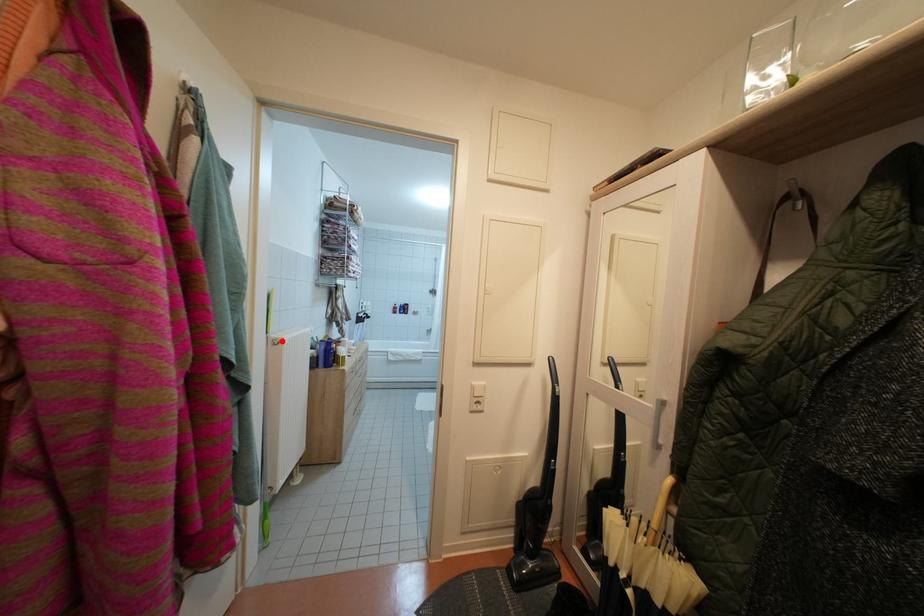
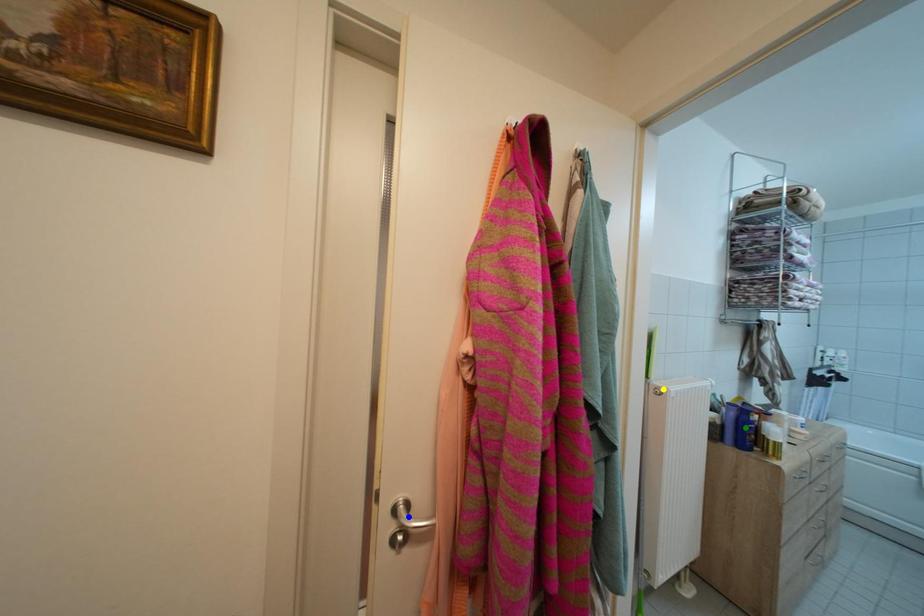
Question: I am providing you with two images of the same scene from different viewpoints. A red point is marked on the first image. You are given multiple points on the second image. Which point in image 2 is actually the same real-world point as the red point in image 1?

Choices:
 (A) blue point
 (B) green point
 (C) yellow point

Answer: (C)